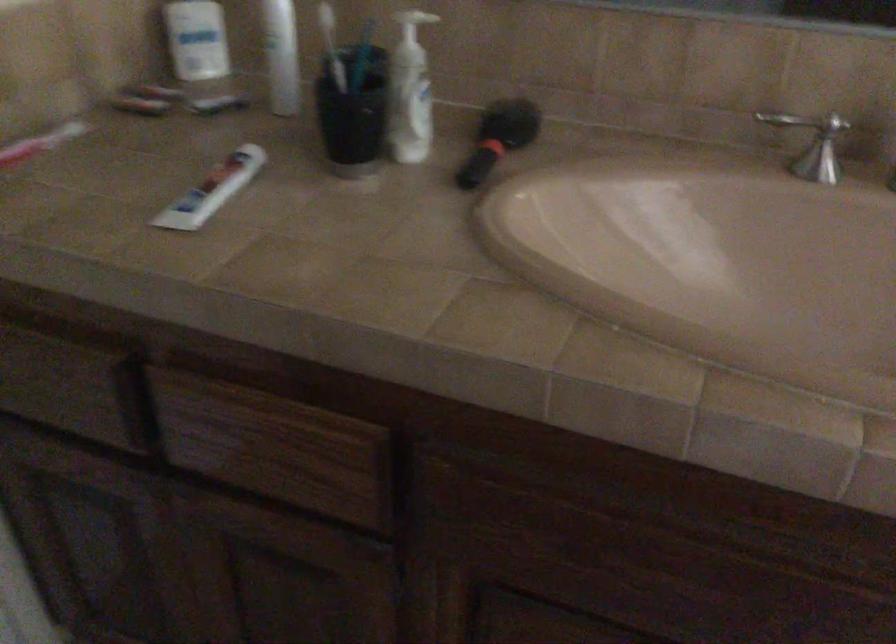
Find where to push the white dispenser pump. Please return your answer as a coordinate pair (x, y).

(412, 23)